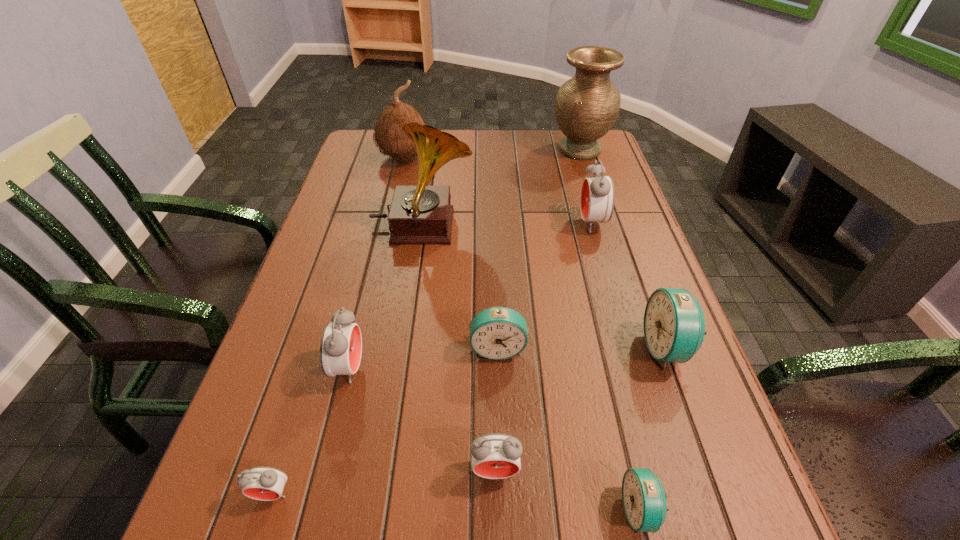
The height and width of the screenshot is (540, 960). Find the location of `object that is at the far right corner`. object that is at the far right corner is located at coordinates (586, 107).

The width and height of the screenshot is (960, 540). In order to click on vacant space at the far edge in this screenshot , I will do pyautogui.click(x=540, y=134).

In order to click on vacant area at the left edge in this screenshot , I will do `click(367, 215)`.

Where is `free space at the right edge`? Image resolution: width=960 pixels, height=540 pixels. free space at the right edge is located at coordinates [x=575, y=206].

The height and width of the screenshot is (540, 960). I want to click on free spot between the leftmost alarm clock and the tallest alarm clock, so click(x=432, y=359).

The height and width of the screenshot is (540, 960). What are the coordinates of `free point between the vase and the brown phonograph record` in the screenshot? It's located at (501, 188).

The height and width of the screenshot is (540, 960). I want to click on unoccupied position between the eighth shortest object and the sixth alarm clock from right to left, so (x=376, y=263).

Where is `free spot between the eighth shortest object and the leftmost blue alarm clock`? Image resolution: width=960 pixels, height=540 pixels. free spot between the eighth shortest object and the leftmost blue alarm clock is located at coordinates (451, 253).

Find the location of a particular element. This screenshot has width=960, height=540. object identified as the eighth closest to the phonograph record is located at coordinates (262, 483).

In order to click on object that is the third closest to the vase in this screenshot , I will do `click(389, 136)`.